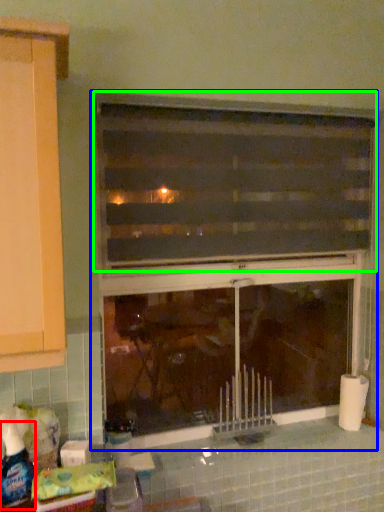
Question: Which is nearer to the bottle (highlighted by a red box)? window (highlighted by a blue box) or window (highlighted by a green box).

Choices:
 (A) window
 (B) window

Answer: (A)